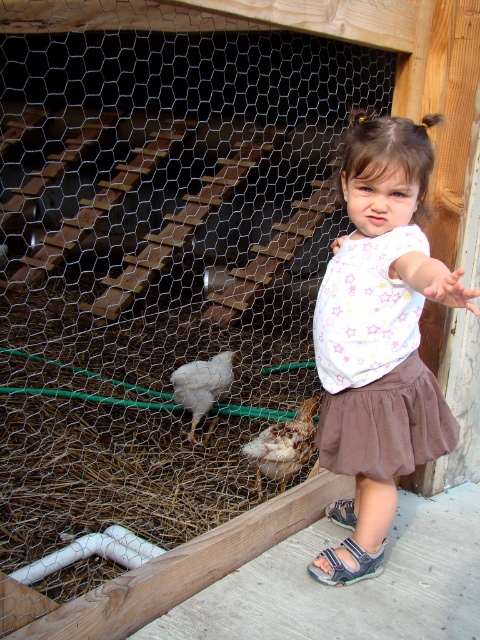
Does white star-patterned shirt at center have a larger size compared to white feathered chicken at center?

Indeed, white star-patterned shirt at center has a larger size compared to white feathered chicken at center.

This screenshot has height=640, width=480. Find the location of `white star-patterned shirt at center`. white star-patterned shirt at center is located at coordinates (379, 339).

At what (x,y) coordinates should I click in order to perform the action: click on white star-patterned shirt at center. Please return your answer as a coordinate pair (x, y). This screenshot has width=480, height=640. Looking at the image, I should click on (379, 339).

Is white star-patterned shirt at center below blue fabric sandal at lower center?

Incorrect, white star-patterned shirt at center is not positioned below blue fabric sandal at lower center.

Who is positioned more to the left, white star-patterned shirt at center or blue fabric sandal at lower center?

blue fabric sandal at lower center

This screenshot has height=640, width=480. I want to click on white star-patterned shirt at center, so click(379, 339).

Between white feathered chicken at center and blue fabric sandal at lower center, which one appears on the left side from the viewer's perspective?

white feathered chicken at center

This screenshot has width=480, height=640. What do you see at coordinates (202, 385) in the screenshot?
I see `white feathered chicken at center` at bounding box center [202, 385].

The image size is (480, 640). What do you see at coordinates (202, 385) in the screenshot?
I see `white feathered chicken at center` at bounding box center [202, 385].

Identify the location of white feathered chicken at center. This screenshot has width=480, height=640. (202, 385).